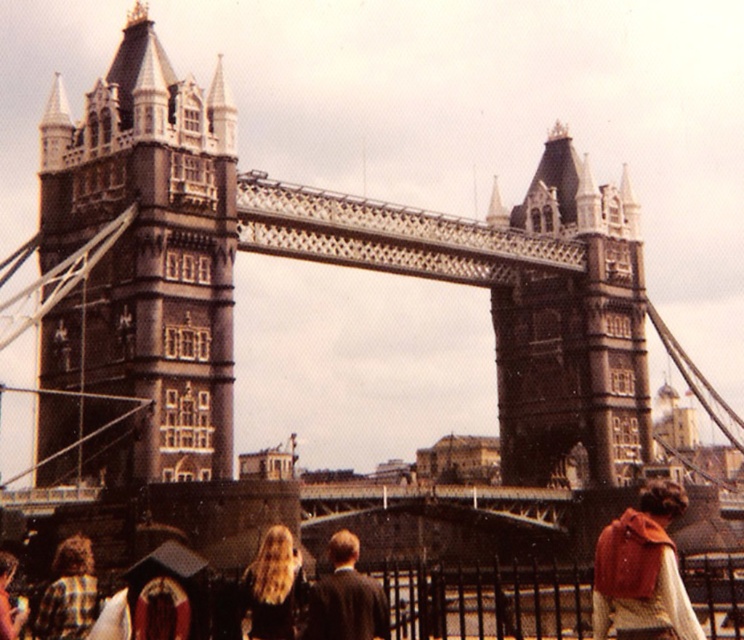
Question: Which of the following is the closest to the observer?

Choices:
 (A) click(86, 576)
 (B) click(323, 605)

Answer: (B)

Question: Which point appears farthest from the camera in this image?

Choices:
 (A) (336, 598)
 (B) (632, 512)
 (C) (77, 568)

Answer: (B)

Question: Does brown stone tower at left appear on the left side of plaid shirt at lower left?

Choices:
 (A) no
 (B) yes

Answer: (B)

Question: Is plaid shirt at lower left to the right of blonde hair at lower left from the viewer's perspective?

Choices:
 (A) yes
 (B) no

Answer: (A)

Question: Which of the following is the closest to the observer?

Choices:
 (A) blonde hair at lower left
 (B) knitted wool scarf at lower right
 (C) brown stone tower at left

Answer: (B)

Question: Does knitted wool scarf at lower right appear on the right side of blonde hair at lower left?

Choices:
 (A) yes
 (B) no

Answer: (A)